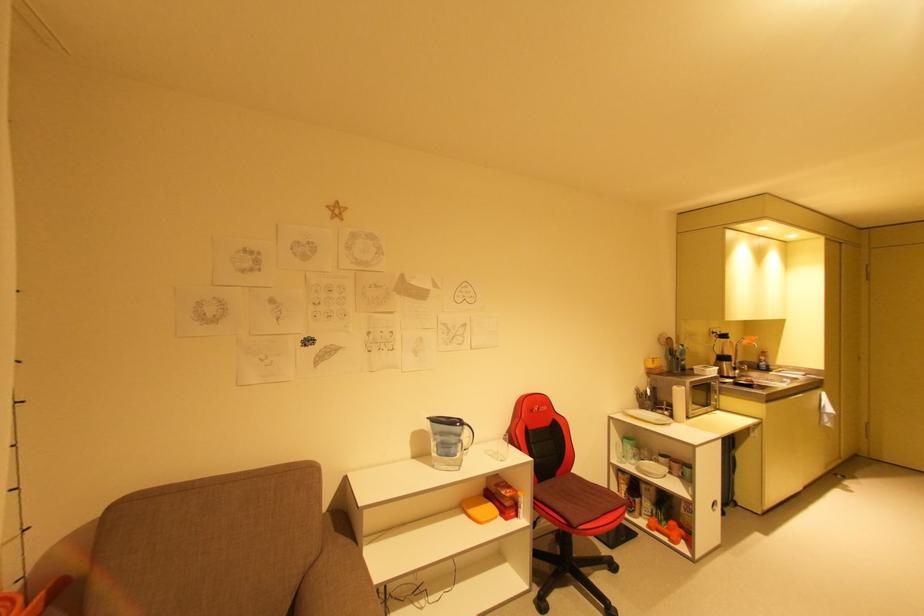
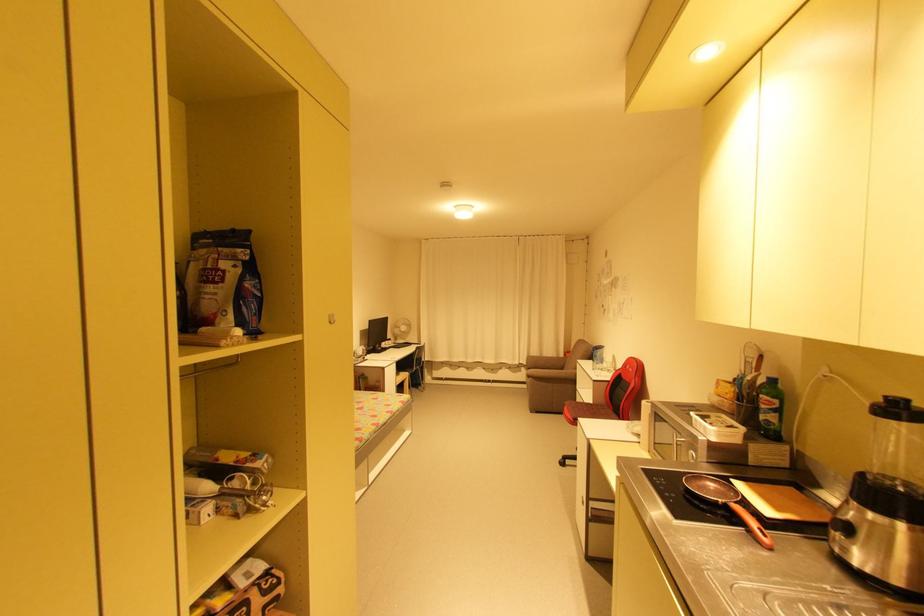
Find the pixel in the second image that matches (541,408) in the first image.

(631, 367)